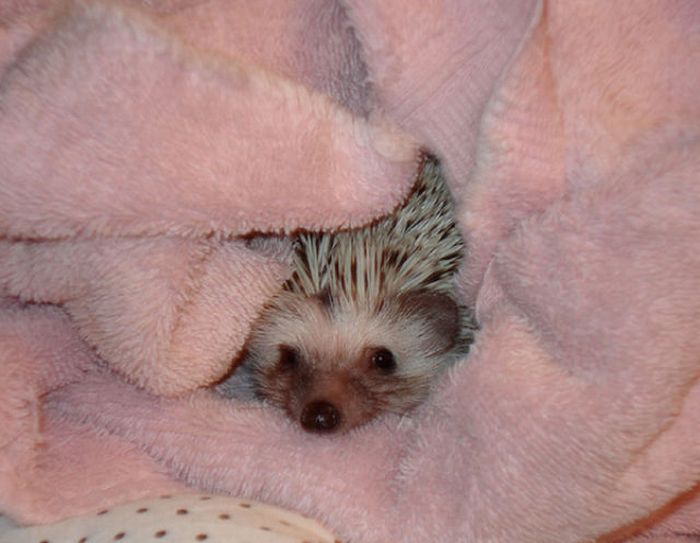
Locate an element on the screen. The height and width of the screenshot is (543, 700). white fur is located at coordinates coord(332,323).